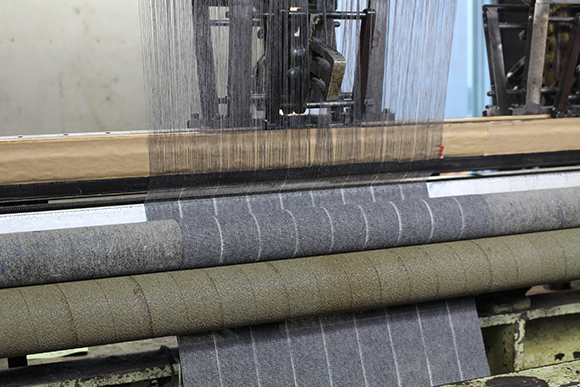
You are a GUI agent. You are given a task and a screenshot of the screen. Output one action in this format:
    pyautogui.click(x=<x>, y=<y>)
    Task: Click on the carpet
    
    Given the screenshot: What is the action you would take?
    pyautogui.click(x=103, y=247)